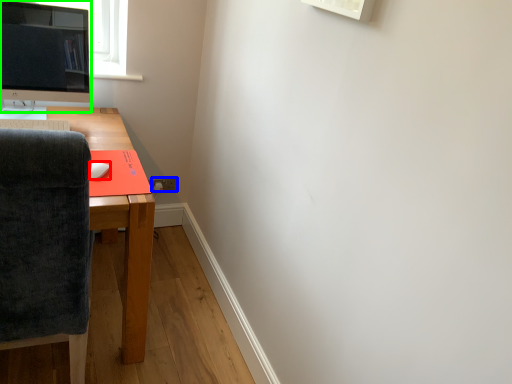
Question: Based on their relative distances, which object is farther from mouse (highlighted by a red box)? Choose from power outlet (highlighted by a blue box) and computer monitor (highlighted by a green box).

Choices:
 (A) power outlet
 (B) computer monitor

Answer: (A)